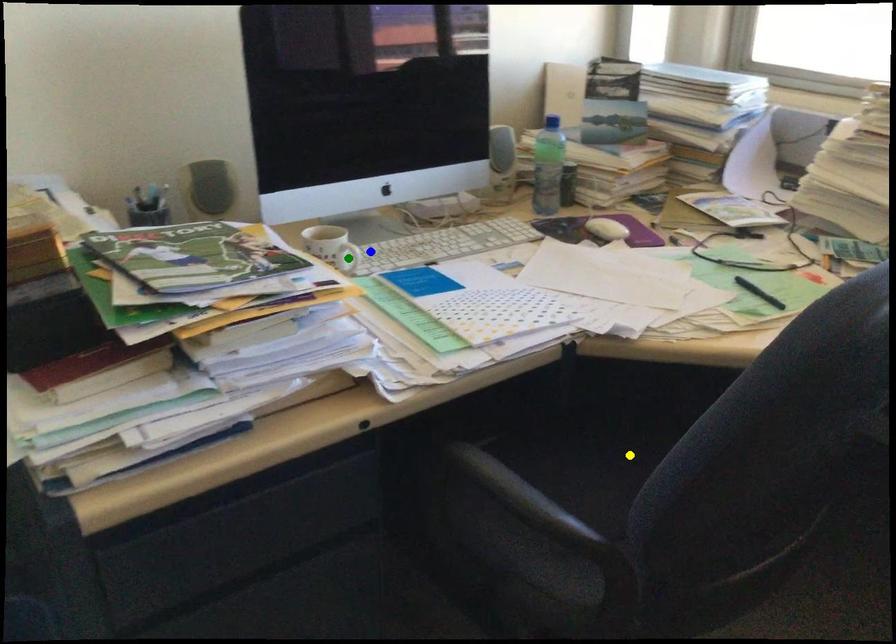
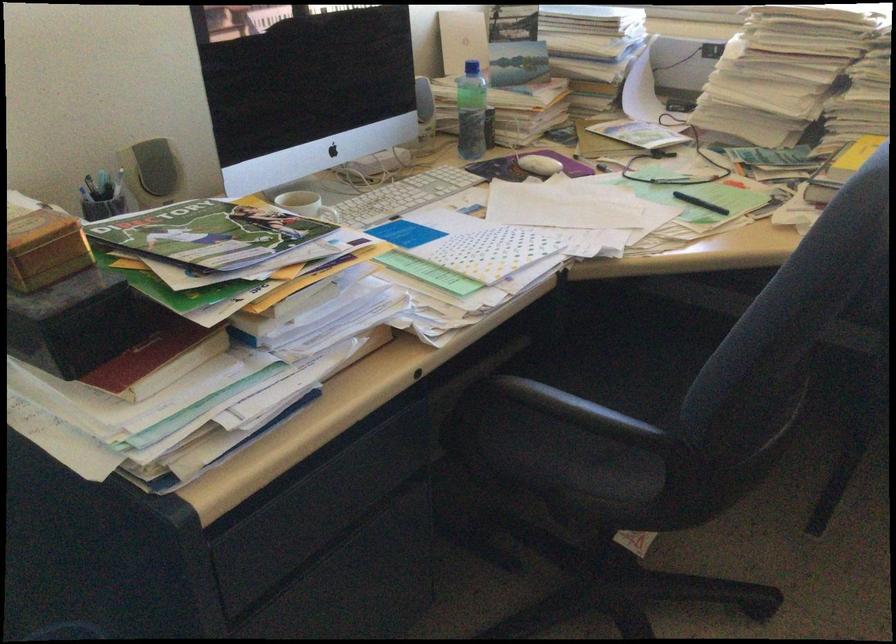
I am providing you with two images of the same scene from different viewpoints. Three points are marked in image1. Which point corresponds to a part or object that is occluded in image2?In image1, three points are marked. Which of them correspond to a part or object that is occluded in image2?Among the three points shown in image1, which one corresponds to a part or object that is no longer visible due to occlusion in image2?

Invisible in image2: green point.